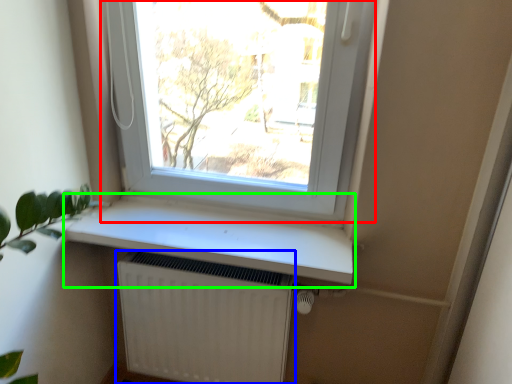
Question: Which is farther away from window (highlighted by a red box)? radiator (highlighted by a blue box) or window sill (highlighted by a green box)?

Choices:
 (A) radiator
 (B) window sill

Answer: (A)